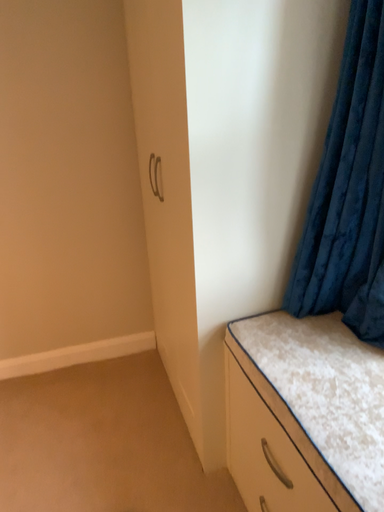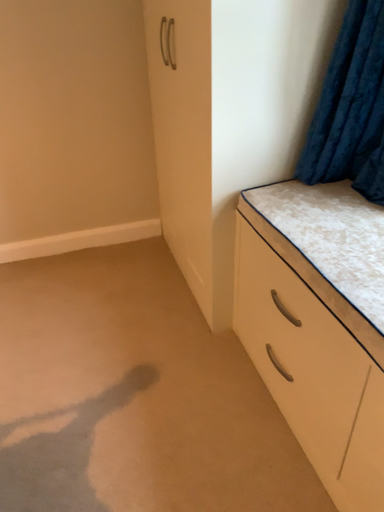
Question: How did the camera likely rotate when shooting the video?

Choices:
 (A) rotated downward
 (B) rotated upward

Answer: (A)